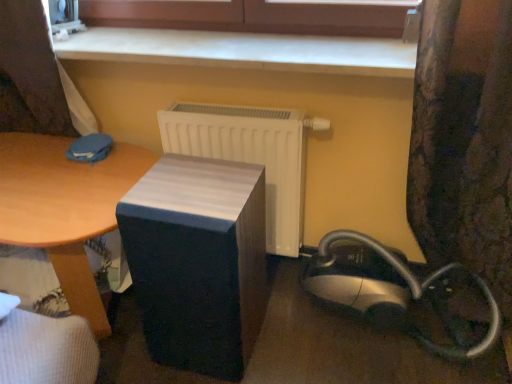
This screenshot has width=512, height=384. I want to click on empty space that is ontop of wooden table at center (from a real-world perspective), so click(x=68, y=175).